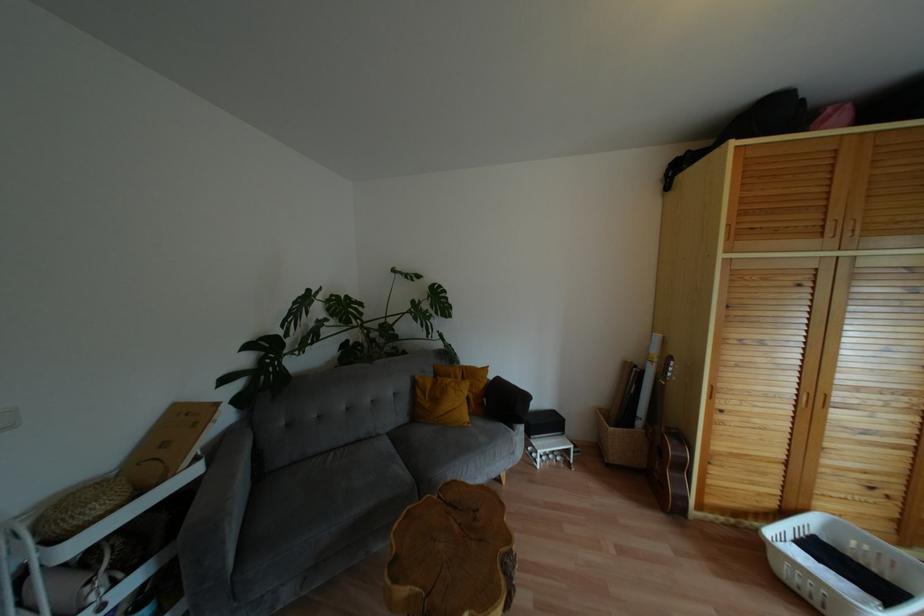
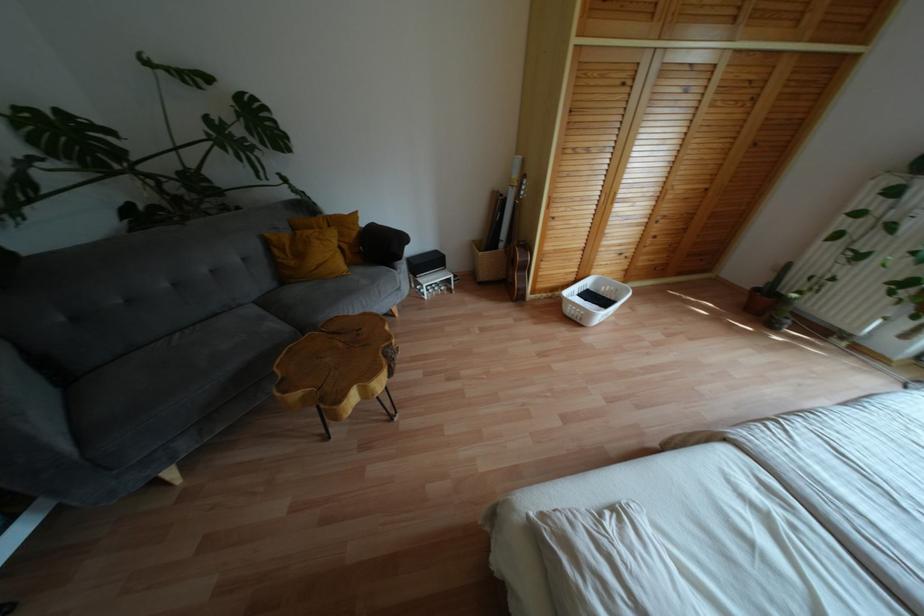
The point at (503,403) is marked in the first image. Where is the corresponding point in the second image?

(380, 246)